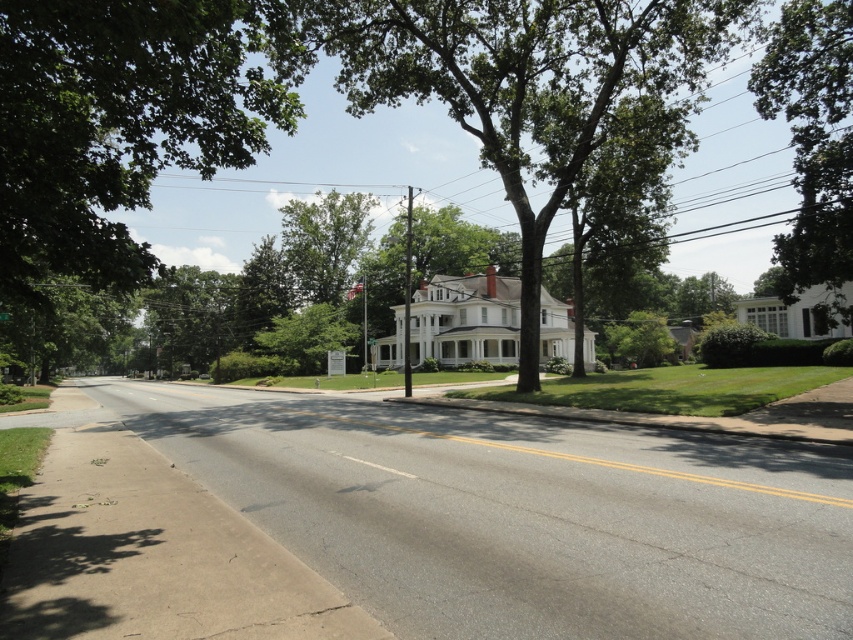
Does green leafy tree at center appear on the left side of green leafy tree at upper right?

Yes, green leafy tree at center is to the left of green leafy tree at upper right.

Does point (532, 134) come farther from viewer compared to point (833, 58)?

Yes, point (532, 134) is farther from viewer.

What do you see at coordinates (524, 83) in the screenshot? This screenshot has width=853, height=640. I see `green leafy tree at center` at bounding box center [524, 83].

Find the location of a particular element. This screenshot has width=853, height=640. green leafy tree at center is located at coordinates (524, 83).